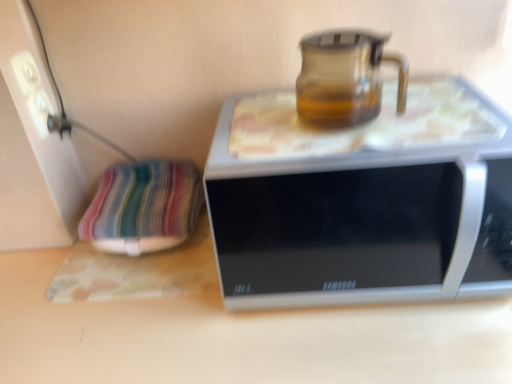
This screenshot has height=384, width=512. What are the coordinates of `free space to the left of silver metallic microwave at center` in the screenshot? It's located at [144, 315].